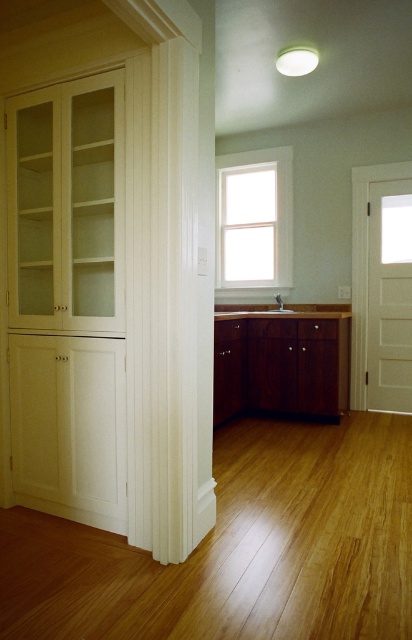
Between point (241, 189) and point (281, 300), which one is positioned in front?

Positioned in front is point (281, 300).

Looking at this image, is white wood window at center positioned before white glossy sink at center?

No, white wood window at center is further to the viewer.

Which is in front, point (220, 234) or point (278, 308)?

Point (278, 308)

This screenshot has height=640, width=412. Identify the location of white wood window at center. (255, 220).

Does point (327, 356) lie behind point (217, 179)?

That is False.

Between point (254, 365) and point (219, 176), which one is positioned behind?

The point (219, 176) is more distant.

Find the location of a particular element. mahogany wood cabinet at center is located at coordinates tap(280, 364).

Does mahogany wood cabinet at center have a smaller size compared to white glossy sink at center?

Actually, mahogany wood cabinet at center might be larger than white glossy sink at center.

Is mahogany wood cabinet at center to the right of white glossy sink at center from the viewer's perspective?

Incorrect, mahogany wood cabinet at center is not on the right side of white glossy sink at center.

Identify the location of mahogany wood cabinet at center. (280, 364).

This screenshot has width=412, height=640. I want to click on mahogany wood cabinet at center, so click(x=280, y=364).